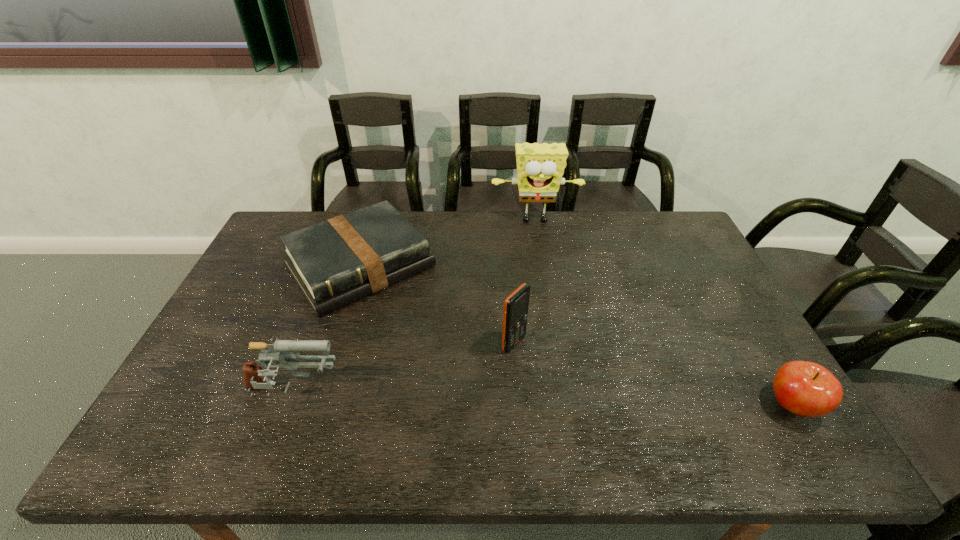
This screenshot has width=960, height=540. Identify the location of apple that is at the near edge. (807, 389).

The height and width of the screenshot is (540, 960). What are the coordinates of `object that is at the left edge` in the screenshot? It's located at (336, 262).

This screenshot has width=960, height=540. In order to click on object that is at the right edge in this screenshot , I will do `click(807, 389)`.

This screenshot has width=960, height=540. In order to click on object that is at the far left corner in this screenshot , I will do `click(336, 262)`.

The width and height of the screenshot is (960, 540). Find the location of `object at the near right corner`. object at the near right corner is located at coordinates (807, 389).

This screenshot has width=960, height=540. Find the location of `vacant space at the far edge of the desktop`. vacant space at the far edge of the desktop is located at coordinates coord(502,244).

The width and height of the screenshot is (960, 540). In the image, there is a desktop. In order to click on blank space at the near edge in this screenshot , I will do `click(500, 387)`.

Locate an element on the screen. vacant space at the left edge of the desktop is located at coordinates [x=195, y=370].

The width and height of the screenshot is (960, 540). In order to click on vacant space at the right edge of the desktop in this screenshot , I will do `click(671, 273)`.

This screenshot has width=960, height=540. I want to click on free location at the far right corner, so click(675, 218).